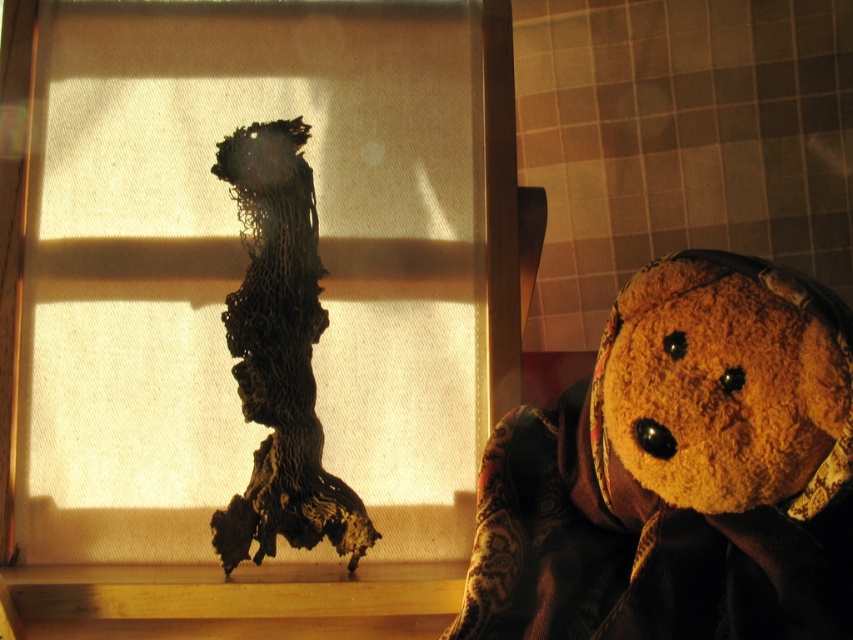
Question: Is translucent fabric at center to the left of fuzzy brown teddy bear at right from the viewer's perspective?

Choices:
 (A) no
 (B) yes

Answer: (B)

Question: Which point is closer to the camera taking this photo?

Choices:
 (A) (357, 541)
 (B) (740, 321)

Answer: (B)

Question: Does translucent fabric at center appear over fuzzy brown teddy bear at right?

Choices:
 (A) no
 (B) yes

Answer: (B)

Question: Estimate the real-world distances between objects in this image. Which object is closer to the translucent fabric at center?

Choices:
 (A) fuzzy brown teddy bear at right
 (B) charcoal textured fabric at center

Answer: (B)

Question: Is translucent fabric at center thinner than fuzzy brown teddy bear at right?

Choices:
 (A) no
 (B) yes

Answer: (A)

Question: Based on their relative distances, which object is farther from the translucent fabric at center?

Choices:
 (A) charcoal textured fabric at center
 (B) fuzzy brown teddy bear at right

Answer: (B)